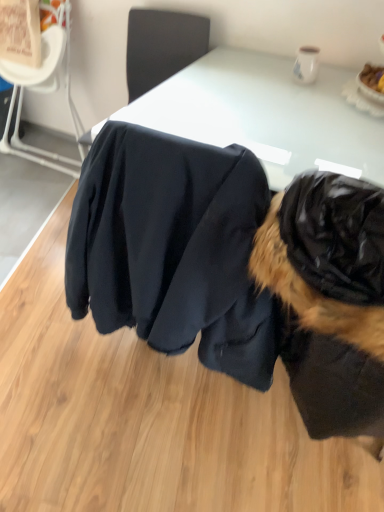
Question: From a real-world perspective, is black fur coat at right above or below matte black jacket at center?

Choices:
 (A) above
 (B) below

Answer: (A)

Question: Does point (292, 196) appear closer or farther from the camera than point (195, 285)?

Choices:
 (A) closer
 (B) farther

Answer: (A)

Question: Which object is positioned farthest from the matte black jacket at center?

Choices:
 (A) black fur coat at right
 (B) black fabric chair at upper center, which is counted as the second chair, starting from the left
 (C) white glossy table at center
 (D) black fabric chair at upper left, the 1th chair from the left

Answer: (D)

Question: Which is farther from the black fabric chair at upper left, the second chair when ordered from right to left?

Choices:
 (A) matte black jacket at center
 (B) black fabric chair at upper center, which is counted as the second chair, starting from the left
 (C) black fur coat at right
 (D) white glossy table at center

Answer: (C)